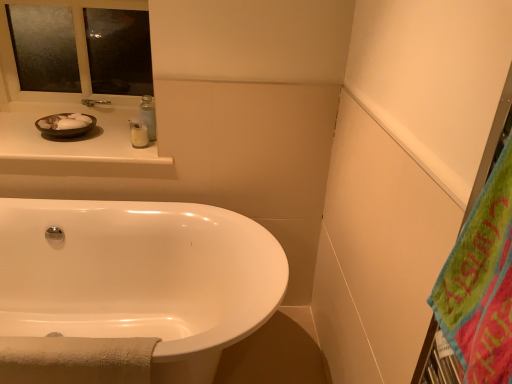
Find the location of a particular element. Image resolution: width=512 pixels, height=384 pixels. unoccupied area in front of white glossy lotion at upper center is located at coordinates (128, 161).